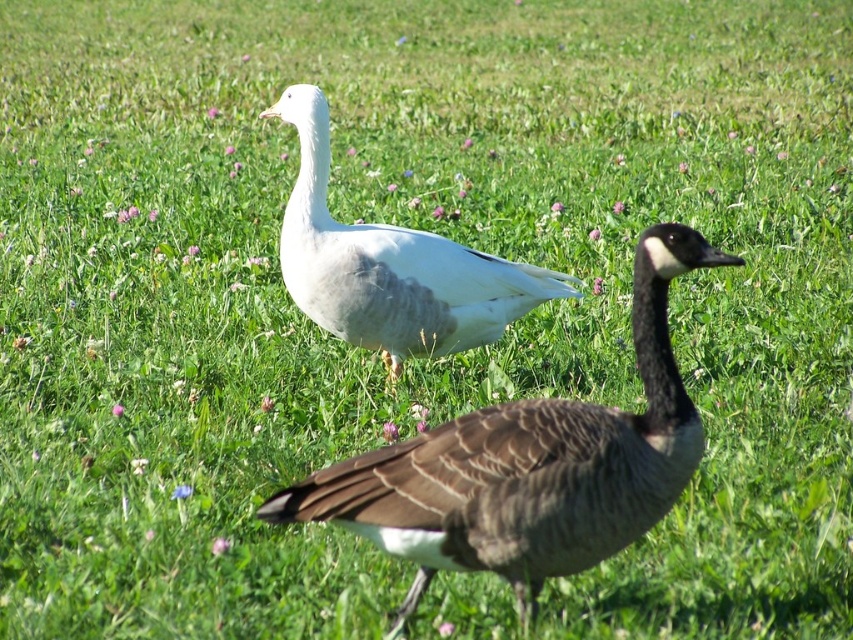
Question: Can you confirm if white feathered goose at upper center is positioned below white matte goose at center?

Choices:
 (A) yes
 (B) no

Answer: (A)

Question: Does white feathered goose at upper center appear on the left side of white matte goose at center?

Choices:
 (A) yes
 (B) no

Answer: (B)

Question: Among these objects, which one is farthest from the camera?

Choices:
 (A) white matte goose at center
 (B) white feathered goose at upper center

Answer: (A)

Question: Is white feathered goose at upper center wider than white matte goose at center?

Choices:
 (A) yes
 (B) no

Answer: (B)